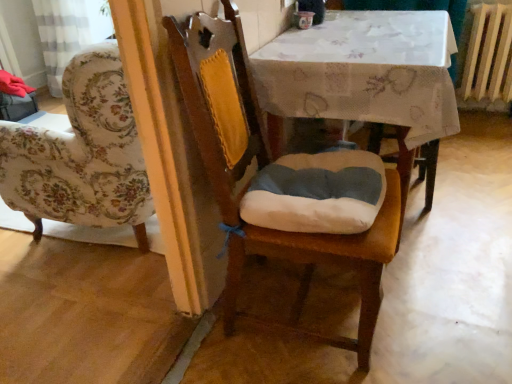
Identify the location of empty space that is in between wooden chair at center and white fabric table at center. (400, 303).